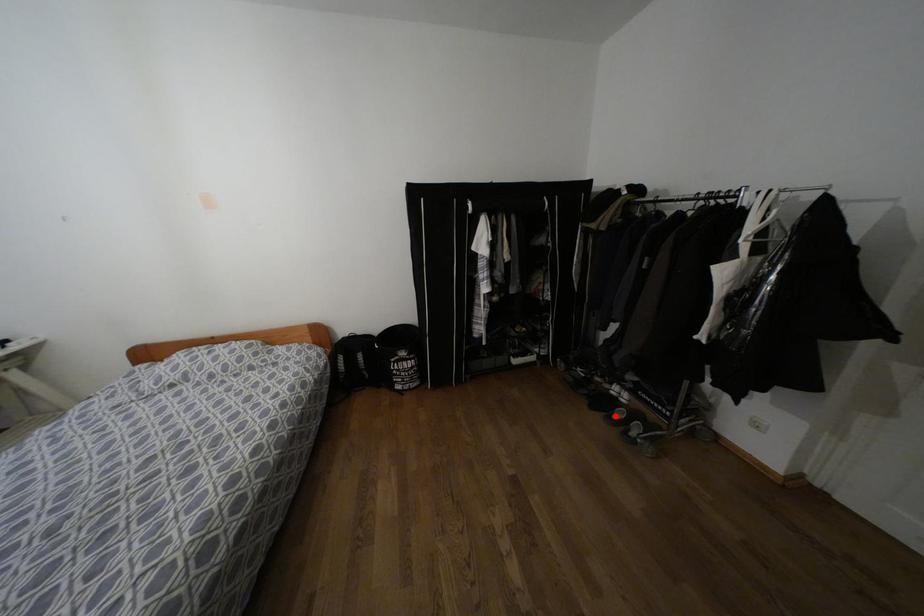
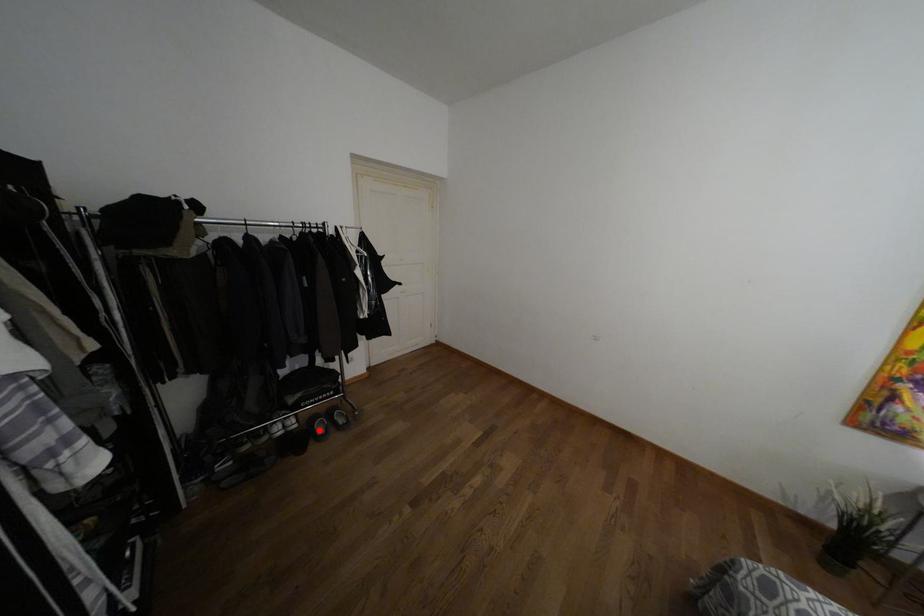
I am providing you with two images of the same scene from different viewpoints. A red point is marked on the first image and another point is marked on the second image. Are the points marked in image1 and image2 representing the same 3D position?

Yes